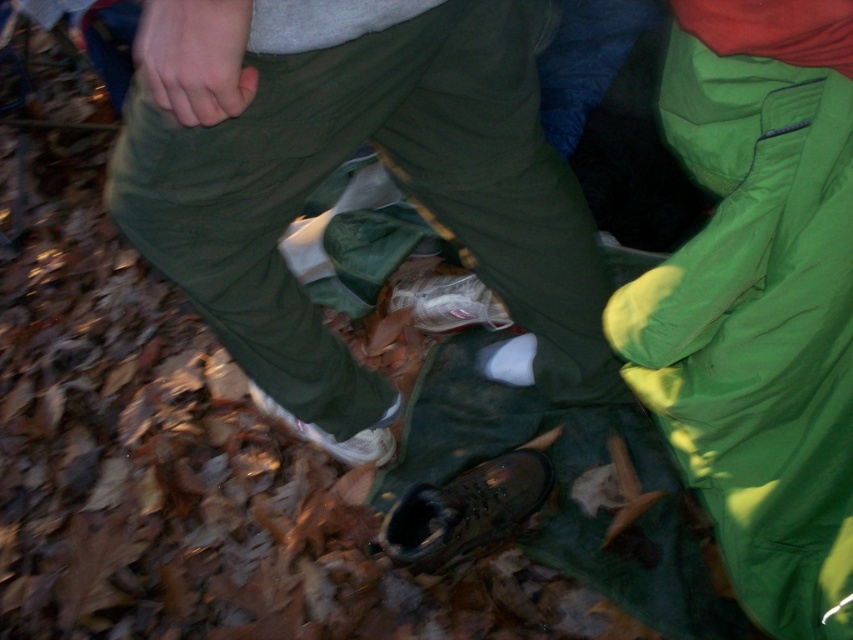
Does green matte pants at center have a smaller size compared to leather boot at lower center?

Incorrect, green matte pants at center is not smaller in size than leather boot at lower center.

Between point (170, 168) and point (534, 488), which one is positioned behind?

The point (534, 488) is more distant.

Which is behind, point (300, 13) or point (459, 497)?

Point (459, 497)

The height and width of the screenshot is (640, 853). I want to click on green matte pants at center, so click(x=335, y=166).

Is green matte pants at center shorter than white matte shoe at lower center?

No.

Can you confirm if green matte pants at center is taller than white matte shoe at lower center?

Yes.

Is point (213, 84) positioned before point (363, 452)?

Yes, it is.

You are a GUI agent. You are given a task and a screenshot of the screen. Output one action in this format:
    pyautogui.click(x=<x>, y=<y>)
    Task: Click on the green matte pants at center
    The image size is (853, 640).
    Given the screenshot: What is the action you would take?
    coord(335,166)

Does translucent plastic shoe at center have a greater width compared to white matte shoe at lower center?

No, translucent plastic shoe at center is not wider than white matte shoe at lower center.

Can you confirm if translucent plastic shoe at center is taller than white matte shoe at lower center?

In fact, translucent plastic shoe at center may be shorter than white matte shoe at lower center.

Find the location of a particular element. translucent plastic shoe at center is located at coordinates (447, 301).